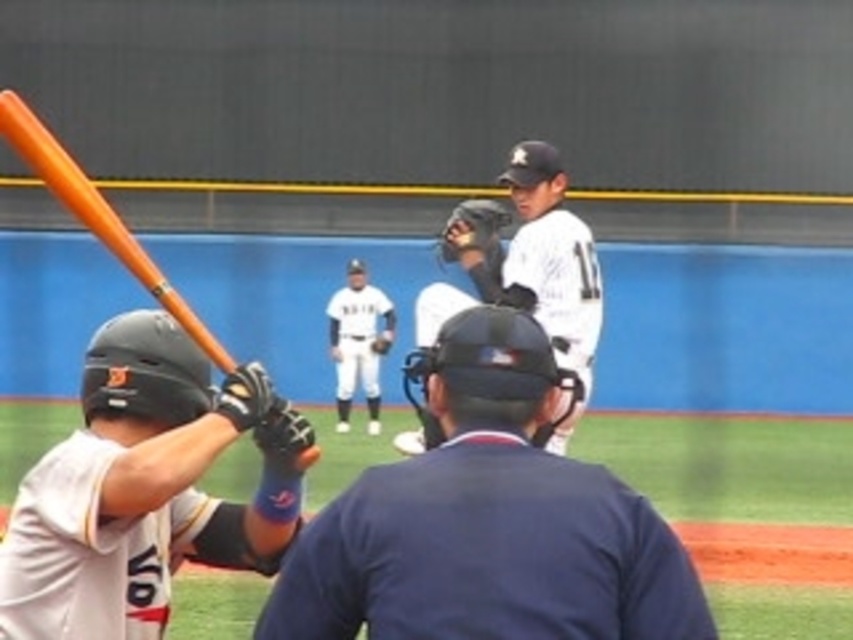
Question: Among these objects, which one is nearest to the camera?

Choices:
 (A) white uniform at center
 (B) black leather baseball glove at center
 (C) matte black helmet at lower left

Answer: (C)

Question: Among these points, which one is farthest from the camera?

Choices:
 (A) (61, 154)
 (B) (361, 280)

Answer: (B)

Question: Is dark blue textured shirt at center closer to the viewer compared to orange matte baseball bat at left?

Choices:
 (A) no
 (B) yes

Answer: (B)

Question: Is dark blue textured shirt at center to the left of white matte baseball glove at upper center from the viewer's perspective?

Choices:
 (A) no
 (B) yes

Answer: (B)

Question: Does white matte baseball glove at upper center come behind white uniform at center?

Choices:
 (A) no
 (B) yes

Answer: (A)

Question: Which point is closer to the camera taking this photo?

Choices:
 (A) (18, 132)
 (B) (125, 342)
 (C) (352, 369)

Answer: (A)